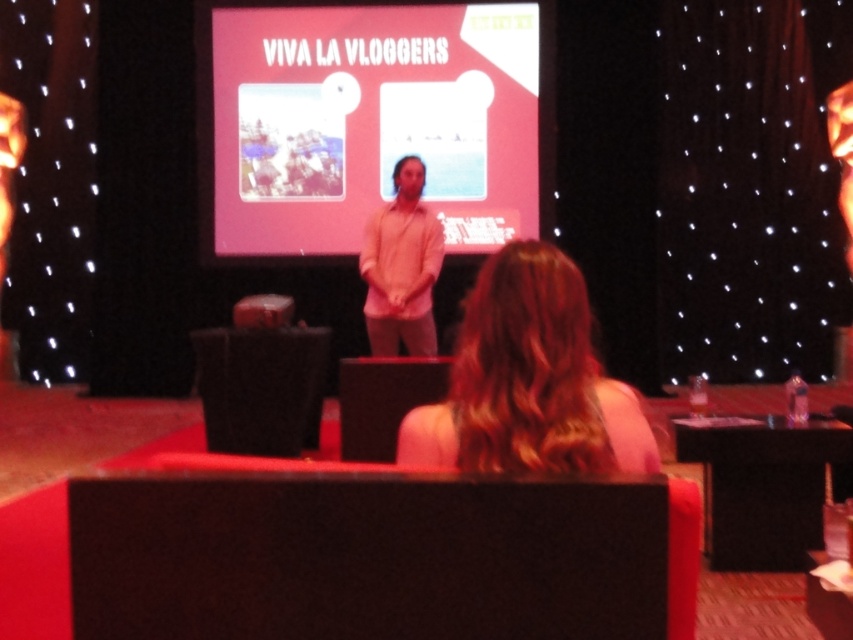
Question: Which object is the closest to the pink cotton shirt at center?

Choices:
 (A) pink matte projection screen at center
 (B) blonde hair at center

Answer: (A)

Question: Is pink matte projection screen at center closer to camera compared to pink cotton shirt at center?

Choices:
 (A) yes
 (B) no

Answer: (B)

Question: Based on their relative distances, which object is farther from the pink cotton shirt at center?

Choices:
 (A) blonde hair at center
 (B) pink matte projection screen at center

Answer: (A)

Question: Does pink matte projection screen at center have a larger size compared to blonde hair at center?

Choices:
 (A) yes
 (B) no

Answer: (A)

Question: Can you confirm if blonde hair at center is positioned above pink cotton shirt at center?

Choices:
 (A) yes
 (B) no

Answer: (B)

Question: Which of these objects is positioned closest to the pink matte projection screen at center?

Choices:
 (A) blonde hair at center
 (B) pink cotton shirt at center

Answer: (B)